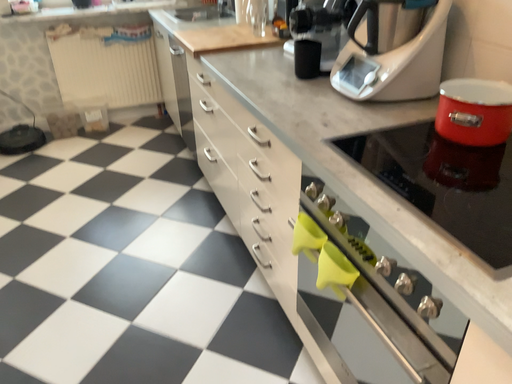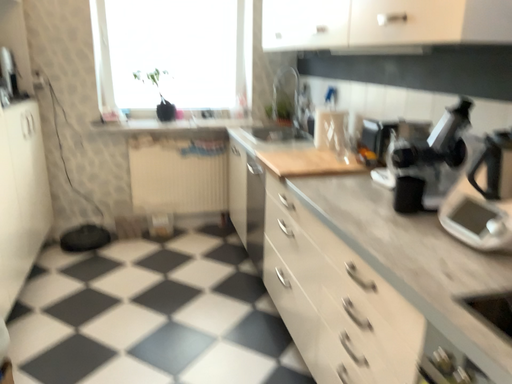
Question: How did the camera likely rotate when shooting the video?

Choices:
 (A) rotated upward
 (B) rotated downward

Answer: (A)